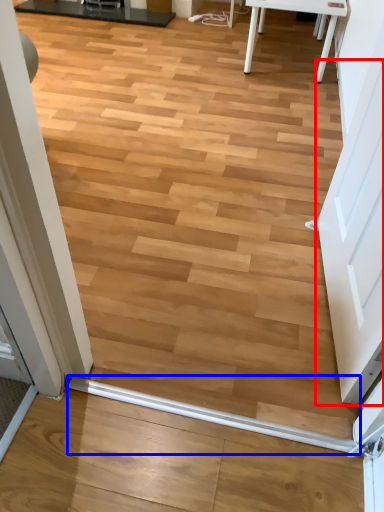
Question: Among these objects, which one is nearest to the camera, screen door (highlighted by a red box) or beam (highlighted by a blue box)?

Choices:
 (A) screen door
 (B) beam

Answer: (A)